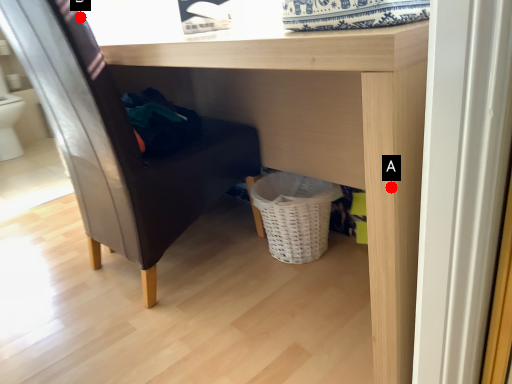
Question: Two points are circled on the image, labeled by A and B beside each circle. Among these points, which one is farthest from the camera?

Choices:
 (A) A is further
 (B) B is further

Answer: (B)